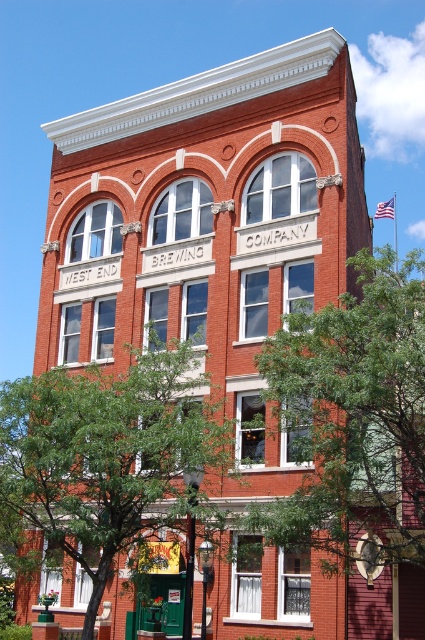
Does green leafy tree at right come in front of green leafy tree at center?

That is True.

Is green leafy tree at right below green leafy tree at center?

Incorrect, green leafy tree at right is not positioned below green leafy tree at center.

Does point (373, 557) lie in front of point (59, 392)?

No, (373, 557) is further to viewer.

Locate an element on the screen. This screenshot has height=640, width=425. green leafy tree at right is located at coordinates (353, 417).